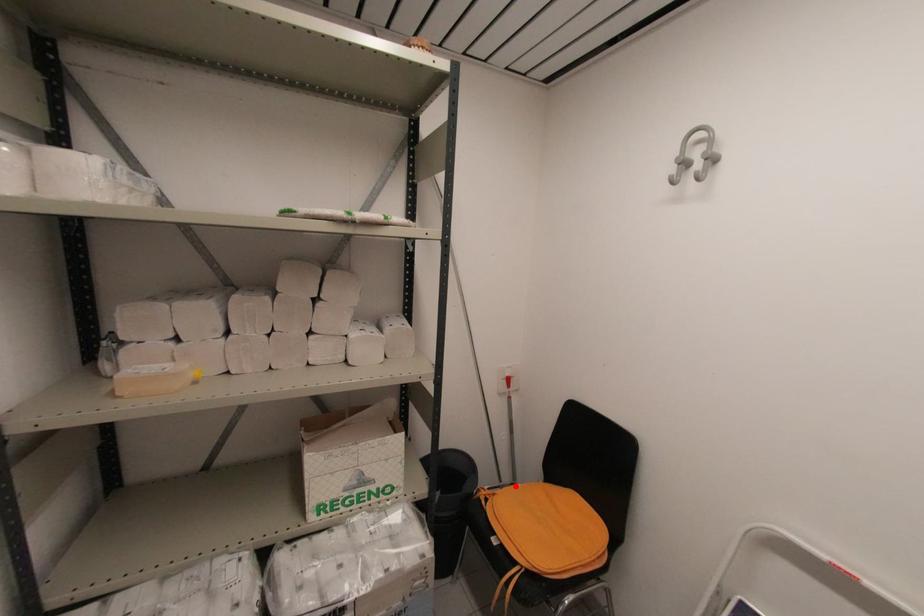
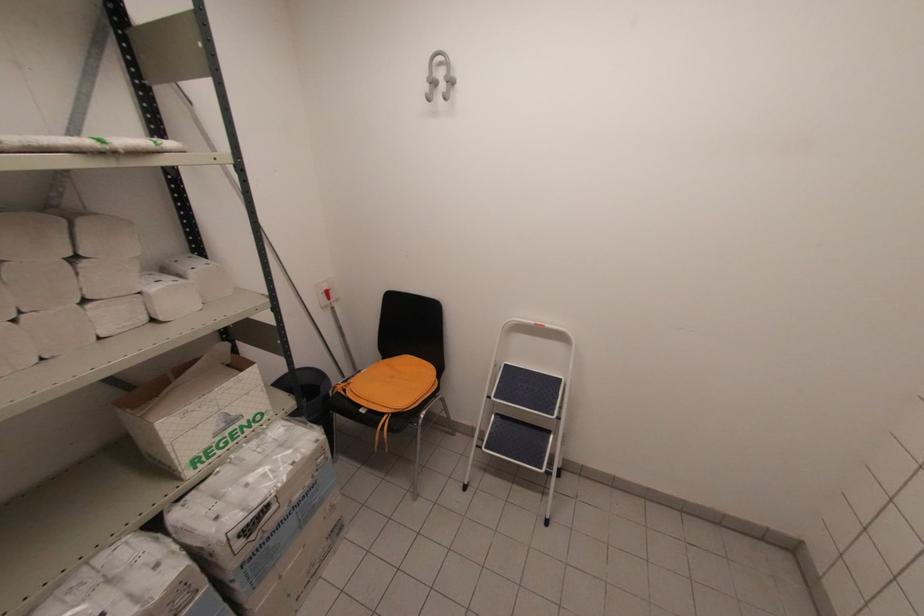
Question: I am providing you with two images of the same scene from different viewpoints. Image1 has a red point marked. In image2, the corresponding 3D location appears at what relative position? Reply with the corresponding letter.

Choices:
 (A) Closer
 (B) Farther

Answer: (B)